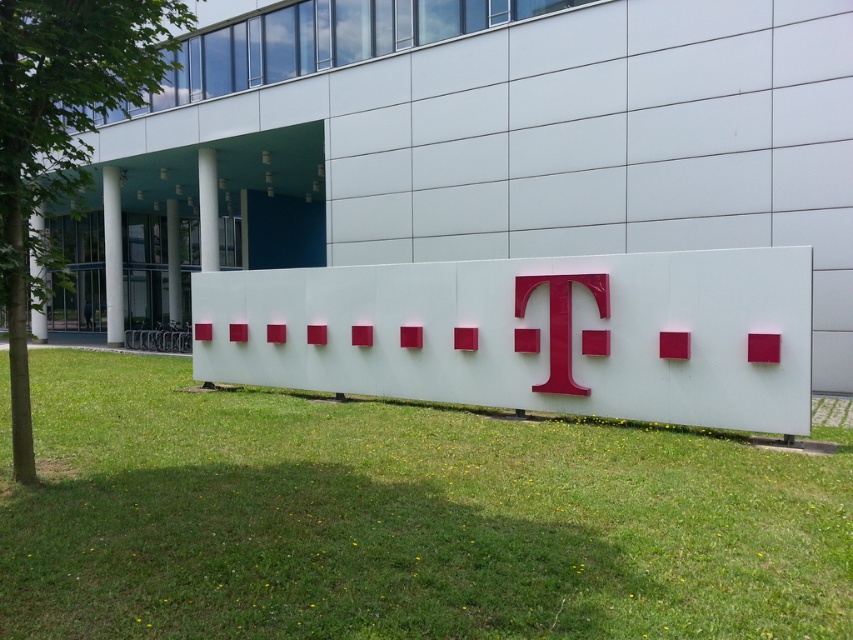
Can you confirm if green grass at lower center is wider than glossy plastic t at center?

Indeed, green grass at lower center has a greater width compared to glossy plastic t at center.

Is green grass at lower center closer to camera compared to glossy plastic t at center?

Yes, it is.

Find the location of a particular element. green grass at lower center is located at coordinates (399, 518).

Is white glossy sign at center taller than glossy plastic t at center?

Correct, white glossy sign at center is much taller as glossy plastic t at center.

Which is in front, point (698, 376) or point (560, 362)?

Point (698, 376) is more forward.

Is point (572, 291) farther from viewer compared to point (549, 353)?

No, it is in front of (549, 353).

In order to click on white glossy sign at center in this screenshot , I will do `click(531, 333)`.

Which is more to the right, green grass at lower center or white glossy sign at center?

Positioned to the right is white glossy sign at center.

Can you confirm if green grass at lower center is positioned above white glossy sign at center?

No, green grass at lower center is not above white glossy sign at center.

This screenshot has width=853, height=640. Describe the element at coordinates (399, 518) in the screenshot. I see `green grass at lower center` at that location.

This screenshot has width=853, height=640. Find the location of `green grass at lower center`. green grass at lower center is located at coordinates (399, 518).